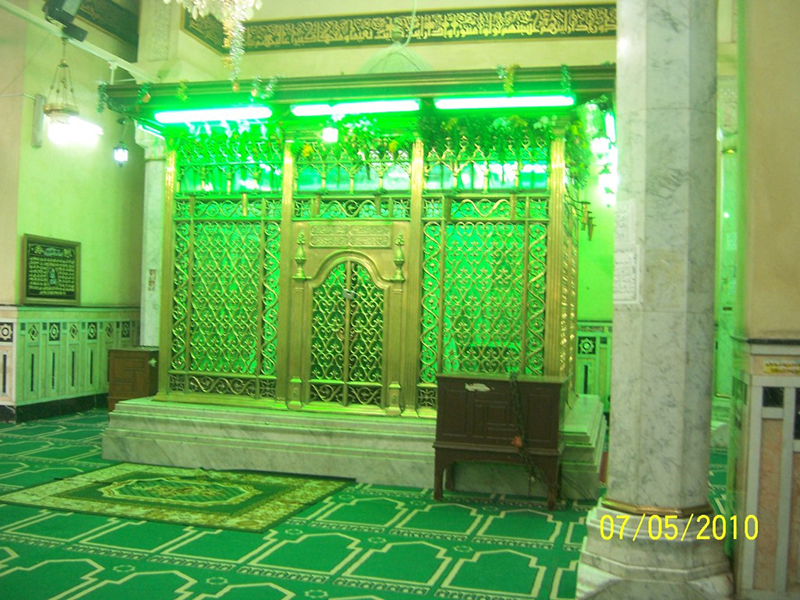
You are a GUI agent. You are given a task and a screenshot of the screen. Output one action in this format:
    pyautogui.click(x=<x>, y=<y>)
    Task: Click on the long lights
    
    Given the screenshot: What is the action you would take?
    pyautogui.click(x=221, y=119), pyautogui.click(x=365, y=117), pyautogui.click(x=522, y=114)